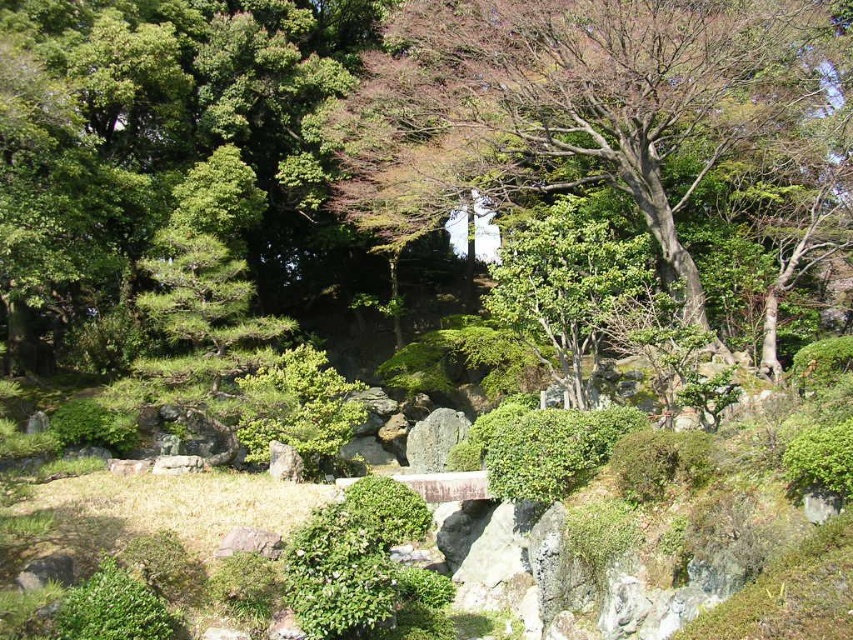
Question: Among these objects, which one is nearest to the camera?

Choices:
 (A) green leafy tree at upper center
 (B) green mossy rock at center

Answer: (A)

Question: Is green leafy tree at upper center below green mossy rock at center?

Choices:
 (A) no
 (B) yes

Answer: (A)

Question: Which object appears farthest from the camera in this image?

Choices:
 (A) green mossy rock at center
 (B) green leafy tree at upper center

Answer: (A)

Question: Does green leafy tree at upper center appear over green mossy rock at center?

Choices:
 (A) yes
 (B) no

Answer: (A)

Question: Observing the image, what is the correct spatial positioning of green leafy tree at upper center in reference to green mossy rock at center?

Choices:
 (A) right
 (B) left

Answer: (A)